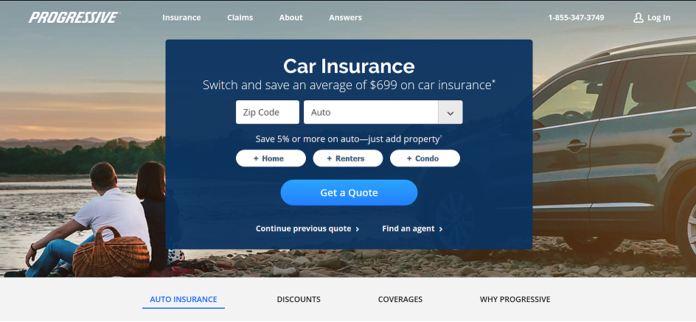
The image size is (696, 322). I want to click on door handle, so click(580, 143).